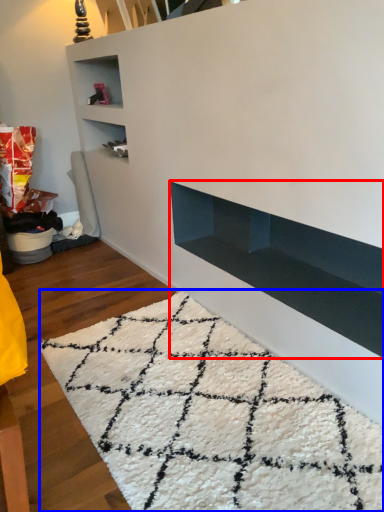
Question: Which point is closer to the camera, shelf (highlighted by a red box) or mat (highlighted by a blue box)?

Choices:
 (A) shelf
 (B) mat

Answer: (B)